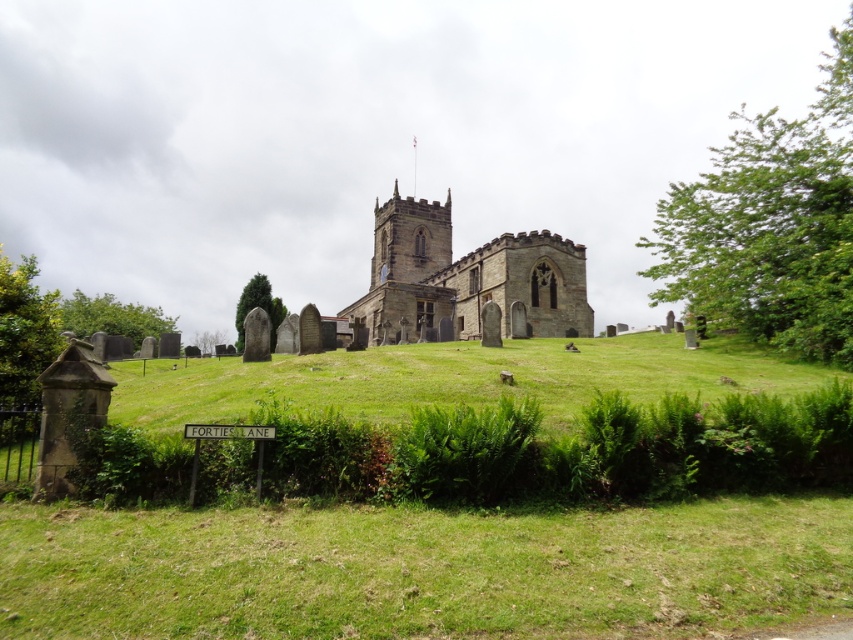
Question: Does green leafy tree at upper right have a greater width compared to stone church at center?

Choices:
 (A) no
 (B) yes

Answer: (B)

Question: Which point is farther to the camera?

Choices:
 (A) (204, 353)
 (B) (820, 93)

Answer: (B)

Question: Is stone church at center further to camera compared to green textured stone at center?

Choices:
 (A) yes
 (B) no

Answer: (A)

Question: Which point appears farthest from the camera in this image?

Choices:
 (A) (201, 342)
 (B) (115, 324)

Answer: (A)

Question: Can you confirm if stone church at center is positioned to the left of green textured stone at center?

Choices:
 (A) yes
 (B) no

Answer: (B)

Question: Based on their relative distances, which object is farther from the stone church at center?

Choices:
 (A) green leafy tree at lower left
 (B) green leafy tree at center

Answer: (B)